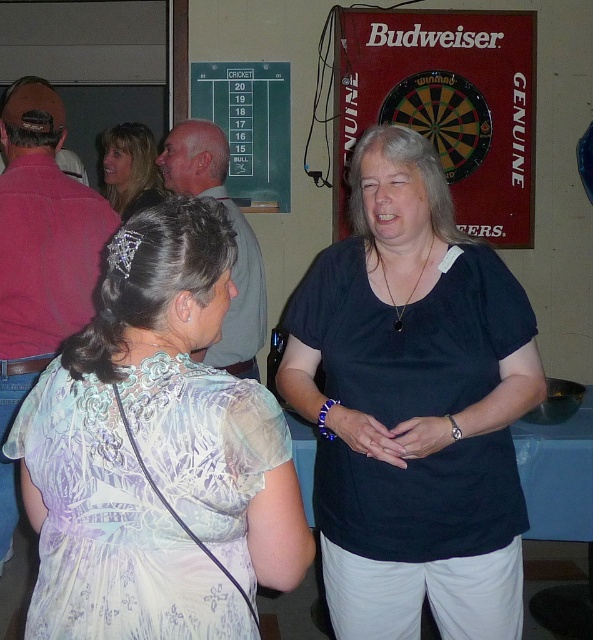
Is black matte shirt at center above blonde hair at upper left?

No.

Which is more to the right, black matte shirt at center or blonde hair at upper left?

From the viewer's perspective, black matte shirt at center appears more on the right side.

Is point (468, 284) behind point (119, 131)?

That is False.

What are the coordinates of `black matte shirt at center` in the screenshot? It's located at (413, 406).

The height and width of the screenshot is (640, 593). What do you see at coordinates (248, 125) in the screenshot?
I see `green chalkboard at upper center` at bounding box center [248, 125].

Based on the photo, does green chalkboard at upper center have a greater width compared to blonde hair at upper left?

Indeed, green chalkboard at upper center has a greater width compared to blonde hair at upper left.

Is point (282, 170) more distant than point (125, 134)?

Yes, it is behind point (125, 134).

Find the location of `green chalkboard at upper center`. green chalkboard at upper center is located at coordinates (248, 125).

Which is above, light purple sheer blouse at center or gray hair at center?

gray hair at center is above.

Does light purple sheer blouse at center have a larger size compared to gray hair at center?

No, light purple sheer blouse at center is not bigger than gray hair at center.

Measure the distance between point (97, 500) and camera.

Point (97, 500) and camera are 3.97 feet apart.

Where is `light purple sheer blouse at center`? light purple sheer blouse at center is located at coordinates (157, 452).